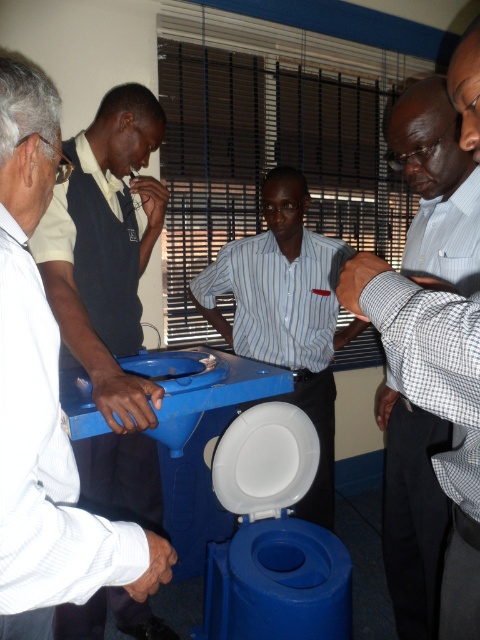
Question: Can you confirm if blue plastic toilet at left is wider than striped cotton shirt at center?

Choices:
 (A) yes
 (B) no

Answer: (B)

Question: Which object is the farthest from the blue plastic toilet at left?

Choices:
 (A) white checkered shirt at center
 (B) striped cotton shirt at center

Answer: (B)

Question: Which object is positioned farthest from the blue plastic toilet at left?

Choices:
 (A) white checkered shirt at center
 (B) striped cotton shirt at center

Answer: (B)

Question: Which object is closer to the camera taking this photo?

Choices:
 (A) blue plastic toilet at left
 (B) striped cotton shirt at center
 (C) white checkered shirt at center

Answer: (A)

Question: Can you confirm if blue plastic toilet at left is wider than striped cotton shirt at center?

Choices:
 (A) no
 (B) yes

Answer: (A)

Question: Is blue plastic toilet at left positioned at the back of white checkered shirt at center?

Choices:
 (A) no
 (B) yes

Answer: (A)